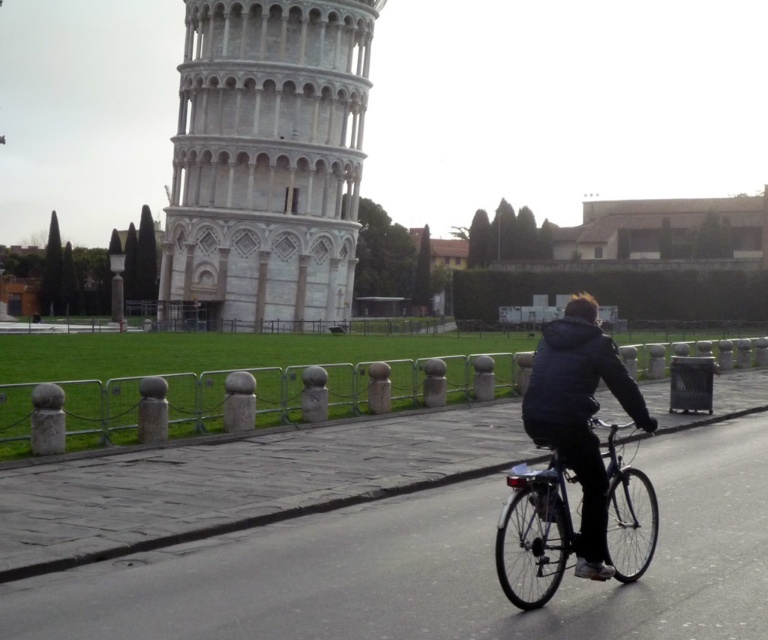
Question: From the image, what is the correct spatial relationship of white stone tower at center in relation to dark gray jacket at center?

Choices:
 (A) right
 (B) left

Answer: (B)

Question: Does dark gray jacket at center appear on the right side of shiny metallic bicycle at lower right?

Choices:
 (A) no
 (B) yes

Answer: (B)

Question: Which of the following is the farthest from the observer?

Choices:
 (A) shiny metallic bicycle at lower right
 (B) dark gray jacket at center
 (C) white stone tower at center

Answer: (C)

Question: Which of the following is the closest to the observer?

Choices:
 (A) shiny metallic bicycle at lower right
 (B) dark gray jacket at center
 (C) white stone tower at center

Answer: (B)

Question: Is the position of white stone tower at center less distant than that of dark gray jacket at center?

Choices:
 (A) no
 (B) yes

Answer: (A)

Question: Which object appears closest to the camera in this image?

Choices:
 (A) shiny metallic bicycle at lower right
 (B) dark gray jacket at center
 (C) white stone tower at center

Answer: (B)